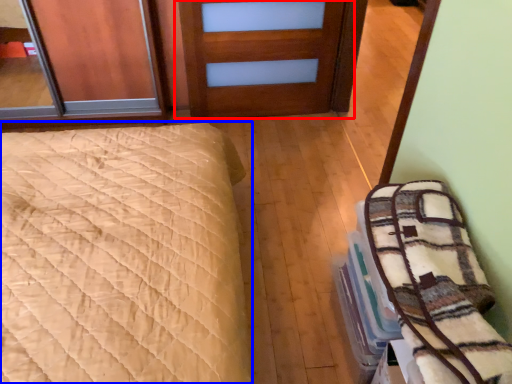
Question: Which object appears closest to the camera in this image, door (highlighted by a red box) or bed (highlighted by a blue box)?

Choices:
 (A) door
 (B) bed

Answer: (B)